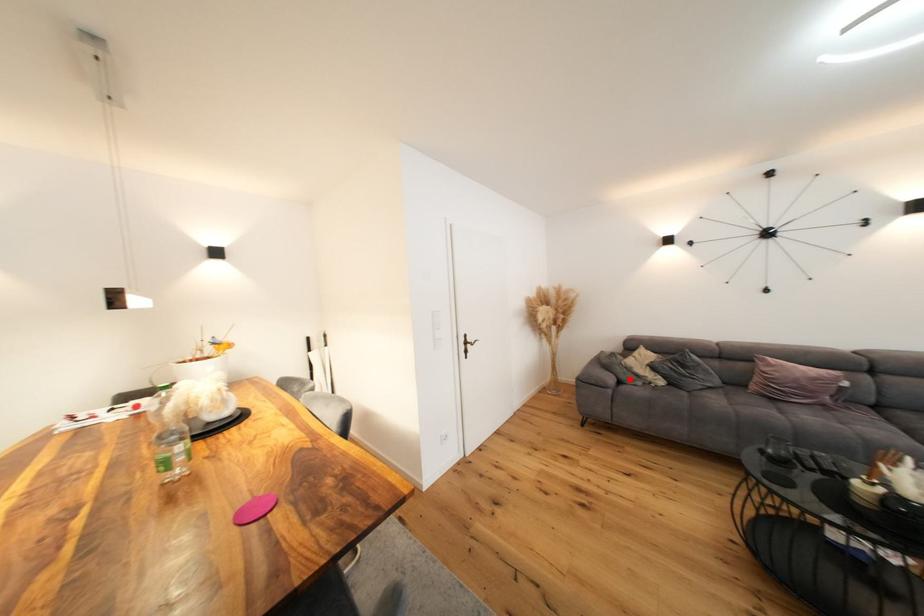
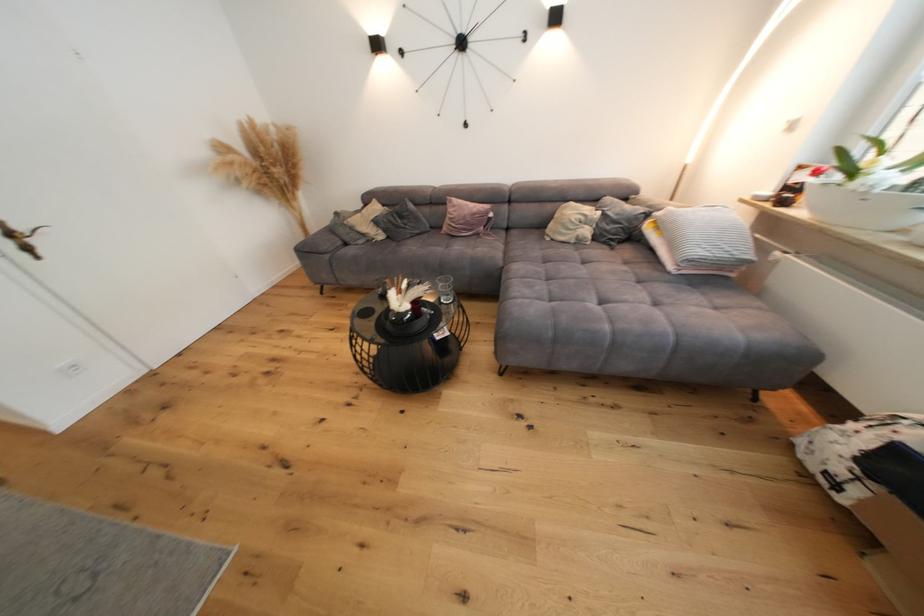
Question: A red point is marked in image1. In image2, is the corresponding 3D point closer to the camera or farther? Reply with the corresponding letter.

Choices:
 (A) The corresponding 3D point is closer.
 (B) The corresponding 3D point is farther.

Answer: (A)